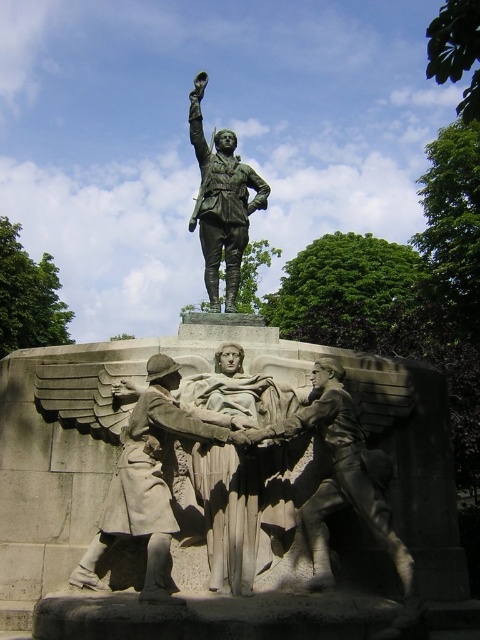
Between bronze statue of soldier at center and bronze statue at upper center, which one appears on the right side from the viewer's perspective?

bronze statue of soldier at center

Does bronze statue of soldier at center appear under bronze statue at upper center?

Yes, bronze statue of soldier at center is below bronze statue at upper center.

Image resolution: width=480 pixels, height=640 pixels. I want to click on bronze statue of soldier at center, so click(x=342, y=476).